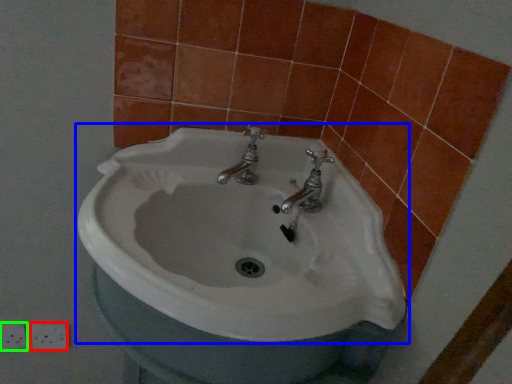
Question: Which object is positioned farthest from ceramic tile (highlighted by a red box)? Select from sink (highlighted by a blue box) and ceramic tile (highlighted by a green box).

Choices:
 (A) sink
 (B) ceramic tile

Answer: (A)